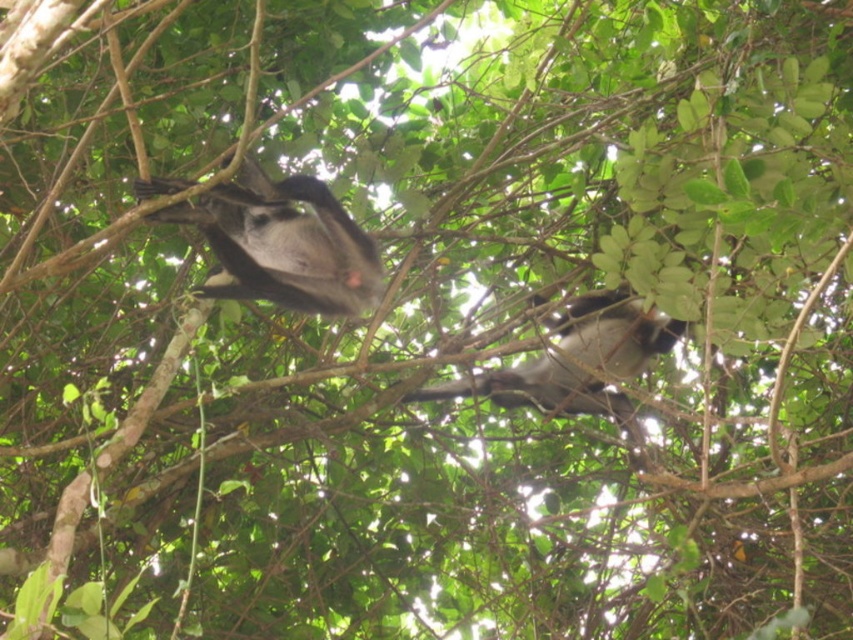
Between point (158, 179) and point (595, 384), which one is positioned in front?

Positioned in front is point (158, 179).

How much distance is there between gray furry monkey at upper center and gray furry monkey at center?

A distance of 29.51 inches exists between gray furry monkey at upper center and gray furry monkey at center.

The width and height of the screenshot is (853, 640). I want to click on gray furry monkey at upper center, so click(283, 243).

Identify the location of gray furry monkey at upper center. (283, 243).